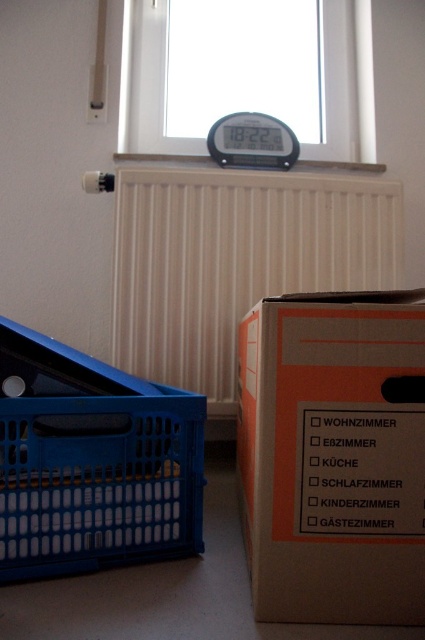
Question: Which of these objects is positioned closest to the blue plastic laundry basket at lower left?

Choices:
 (A) orange cardboard box at center
 (B) transparent glass window at upper center
 (C) white matte radiator at center
 (D) black plastic alarm clock at upper center

Answer: (A)

Question: Does orange cardboard box at center appear on the right side of blue plastic laundry basket at lower left?

Choices:
 (A) yes
 (B) no

Answer: (A)

Question: Where is white matte radiator at center located in relation to transparent glass window at upper center in the image?

Choices:
 (A) above
 (B) below

Answer: (B)

Question: Which of the following is the closest to the observer?

Choices:
 (A) blue plastic laundry basket at lower left
 (B) transparent glass window at upper center
 (C) orange cardboard box at center
 (D) white matte radiator at center

Answer: (C)

Question: Which object is positioned farthest from the black plastic alarm clock at upper center?

Choices:
 (A) white matte radiator at center
 (B) blue plastic laundry basket at lower left
 (C) orange cardboard box at center

Answer: (B)

Question: Does blue plastic laundry basket at lower left appear under transparent glass window at upper center?

Choices:
 (A) yes
 (B) no

Answer: (A)